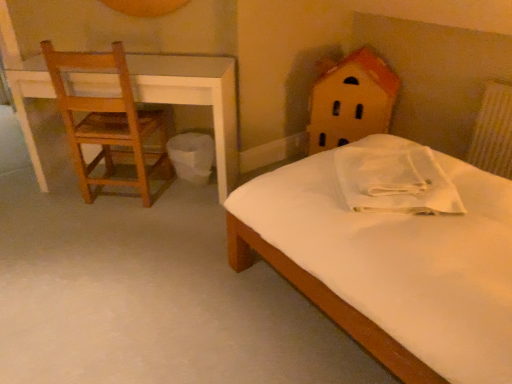
Locate an element on the screen. free space above white plastic trash bin at lower center (from a real-world perspective) is located at coordinates (185, 141).